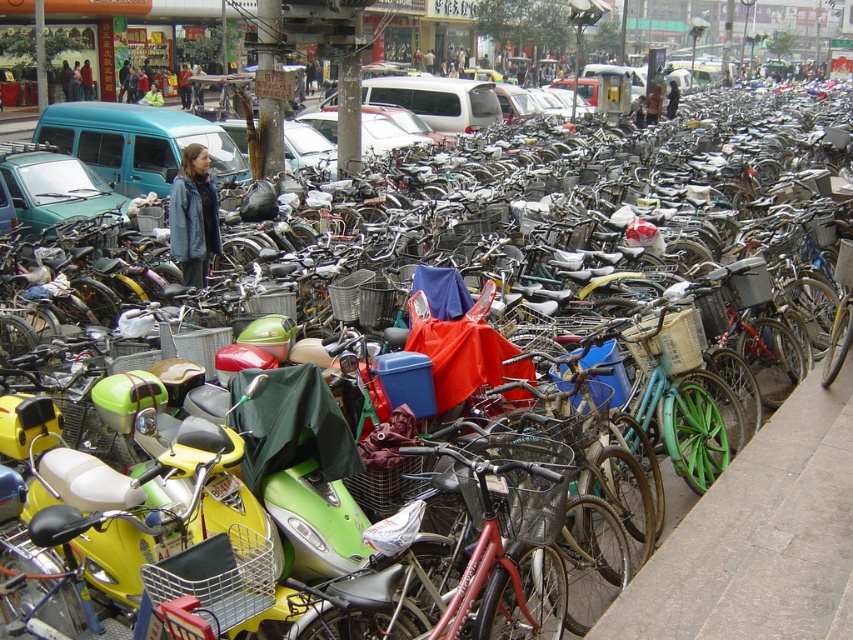
This screenshot has width=853, height=640. In order to click on gray concrete pavement at lower right in this screenshot , I will do `click(759, 538)`.

This screenshot has width=853, height=640. What do you see at coordinates (759, 538) in the screenshot? I see `gray concrete pavement at lower right` at bounding box center [759, 538].

Is point (784, 577) positioned behind point (219, 577)?

Yes, it is behind point (219, 577).

The height and width of the screenshot is (640, 853). Find the location of `gray concrete pavement at lower right`. gray concrete pavement at lower right is located at coordinates (759, 538).

Who is positioned more to the left, yellow matte scooter at lower left or matte green van at left?

From the viewer's perspective, matte green van at left appears more on the left side.

Does point (53, 449) come in front of point (10, 166)?

Yes, it is in front of point (10, 166).

You are a GUI agent. You are given a task and a screenshot of the screen. Output one action in this format:
    pyautogui.click(x=<x>, y=<y>)
    Task: Click on the yellow matte scooter at lower left
    Image resolution: width=853 pixels, height=640 pixels.
    Given the screenshot: What is the action you would take?
    pyautogui.click(x=144, y=518)

Who is more distant from viewer, (840, 557) or (68, 195)?

Positioned behind is point (68, 195).

Does point (798, 628) lie behind point (30, 161)?

No.

Who is more distant from viewer, [840,392] or [57,200]?

The point [57,200] is behind.

Locate an element on the screen. Image resolution: width=853 pixels, height=640 pixels. gray concrete pavement at lower right is located at coordinates (759, 538).